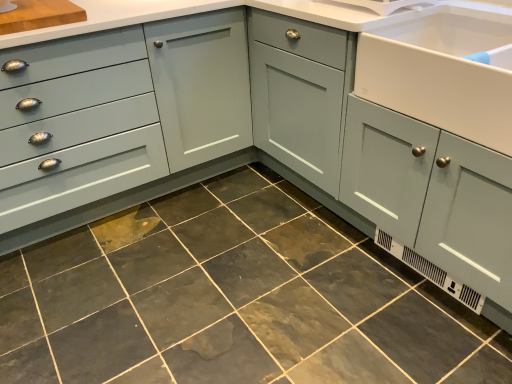
Question: Is white glossy sink at right inside or outside of dark gray stone tile at center?

Choices:
 (A) inside
 (B) outside

Answer: (B)

Question: Considering the positions of point (450, 84) and point (248, 168), is point (450, 84) closer or farther from the camera than point (248, 168)?

Choices:
 (A) farther
 (B) closer

Answer: (B)

Question: Based on their relative distances, which object is nearer to the matte gray drawer at left?

Choices:
 (A) dark gray stone tile at center
 (B) white glossy sink at right

Answer: (A)

Question: Which object is positioned farthest from the dark gray stone tile at center?

Choices:
 (A) matte gray drawer at left
 (B) white glossy sink at right

Answer: (B)